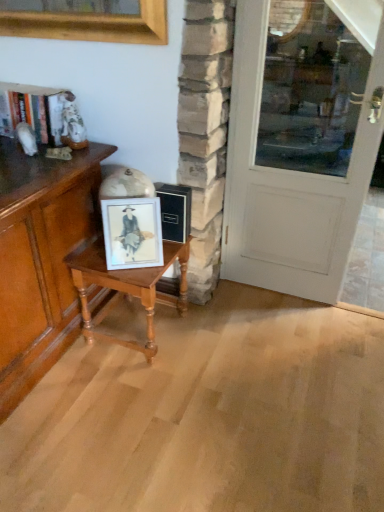
Question: In terms of height, does matte wood cabinet at left look taller or shorter compared to white painted wood door at right?

Choices:
 (A) tall
 (B) short

Answer: (B)

Question: In terms of size, does matte wood cabinet at left appear bigger or smaller than white painted wood door at right?

Choices:
 (A) big
 (B) small

Answer: (A)

Question: Which object is the closest to the matte wood cabinet at left?

Choices:
 (A) wooden table at center
 (B) white painted wood door at right
 (C) matte white frame at center

Answer: (A)

Question: Which object is positioned closest to the matte white frame at center?

Choices:
 (A) wooden table at center
 (B) white painted wood door at right
 (C) matte wood cabinet at left

Answer: (A)